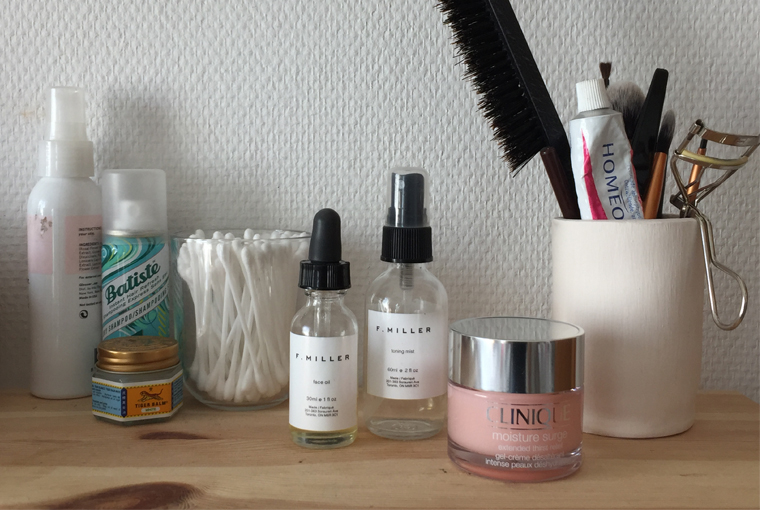
Identify the location of q-tips. This screenshot has width=760, height=510. (223, 309).